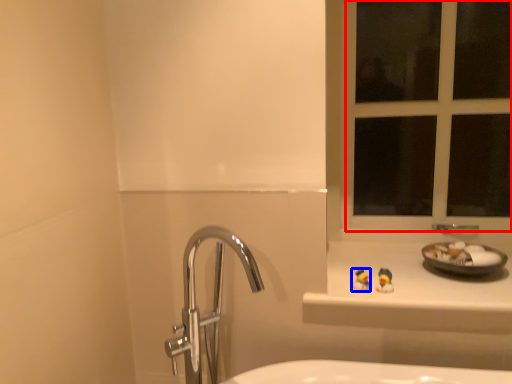
Question: Which point is closer to the camera, window frame (highlighted by a red box) or miniature (highlighted by a blue box)?

Choices:
 (A) window frame
 (B) miniature

Answer: (B)